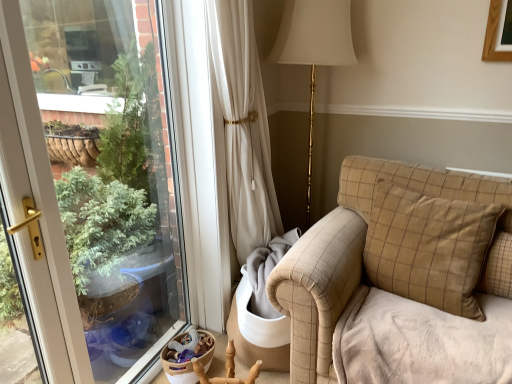
What do you see at coordinates (498, 267) in the screenshot? The height and width of the screenshot is (384, 512). I see `beige checkered pillow at right` at bounding box center [498, 267].

At what (x,y) coordinates should I click in order to perform the action: click on beige checkered couch at right. Please return your answer as a coordinate pair (x, y). This screenshot has width=512, height=384. Looking at the image, I should click on (353, 253).

Image resolution: width=512 pixels, height=384 pixels. What are the coordinates of `wooden armchair at lower center` in the screenshot? It's located at (227, 370).

You are a GUI agent. You are given a task and a screenshot of the screen. Output one action in this format:
    pyautogui.click(x=<x>, y=<y>)
    Task: Click on the beige checkered pillow at right
    The width and height of the screenshot is (512, 384).
    Given the screenshot: What is the action you would take?
    pyautogui.click(x=498, y=267)

Which is more to the left, wooden armchair at lower center or beige checkered couch at right?

wooden armchair at lower center.

Between wooden armchair at lower center and beige checkered couch at right, which one has more height?

beige checkered couch at right is taller.

Identify the location of armchair below the beige checkered couch at right (from a real-world perspective). This screenshot has height=384, width=512. (227, 370).

Based on their sizes in the image, would you say beige checkered pillow at right is bigger or smaller than beige checkered couch at right?

beige checkered pillow at right is smaller than beige checkered couch at right.

Considering the relative sizes of beige checkered pillow at right and beige checkered couch at right in the image provided, is beige checkered pillow at right wider than beige checkered couch at right?

No, beige checkered pillow at right is not wider than beige checkered couch at right.

Considering the sizes of objects beige checkered pillow at right and beige checkered couch at right in the image provided, who is taller, beige checkered pillow at right or beige checkered couch at right?

beige checkered couch at right.

Who is more distant, beige checkered pillow at right or wooden armchair at lower center?

wooden armchair at lower center is behind.

The image size is (512, 384). Identify the location of armchair that appears below the beige checkered pillow at right (from a real-world perspective). (227, 370).

From the image's perspective, who appears lower, beige checkered pillow at right or wooden armchair at lower center?

wooden armchair at lower center appears lower in the image.

Is wooden armchair at lower center not within beige checkered pillow at right?

Absolutely, wooden armchair at lower center is external to beige checkered pillow at right.

Is point (197, 366) more distant than point (490, 253)?

Yes, point (197, 366) is farther from viewer.

Which object is thinner, wooden armchair at lower center or beige checkered pillow at right?

Thinner between the two is beige checkered pillow at right.

Looking at this image, which of these two, wooden armchair at lower center or beige checkered pillow at right, stands shorter?

wooden armchair at lower center.

Can you confirm if beige checkered couch at right is positioned to the right of wooden armchair at lower center?

Yes, beige checkered couch at right is to the right of wooden armchair at lower center.

Is beige checkered couch at right aimed at wooden armchair at lower center?

No, beige checkered couch at right is not aimed at wooden armchair at lower center.

Is beige checkered couch at right positioned far away from wooden armchair at lower center?

No, there isn't a large distance between beige checkered couch at right and wooden armchair at lower center.

Could you tell me if beige checkered couch at right is turned towards beige checkered pillow at right?

No, beige checkered couch at right is not oriented towards beige checkered pillow at right.

From the image's perspective, who appears lower, beige checkered couch at right or beige checkered pillow at right?

beige checkered pillow at right is shown below in the image.

I want to click on armchair that is under the beige checkered couch at right (from a real-world perspective), so click(x=227, y=370).

You are a GUI agent. You are given a task and a screenshot of the screen. Output one action in this format:
    pyautogui.click(x=<x>, y=<y>)
    Task: Click on the studio couch positioned vertically above the beige checkered pillow at right (from a real-world perspective)
    
    Given the screenshot: What is the action you would take?
    pyautogui.click(x=353, y=253)

Which object lies nearer to the anchor point beige checkered couch at right, beige checkered pillow at right or wooden armchair at lower center?

Among the two, beige checkered pillow at right is located nearer to beige checkered couch at right.

When comparing their distances from beige checkered couch at right, does wooden armchair at lower center or beige checkered pillow at right seem closer?

beige checkered pillow at right is positioned closer to the anchor beige checkered couch at right.

When comparing their distances from beige checkered pillow at right, does beige checkered couch at right or wooden armchair at lower center seem closer?

Based on the image, beige checkered couch at right appears to be nearer to beige checkered pillow at right.

Based on their spatial positions, is beige checkered couch at right or beige checkered pillow at right closer to wooden armchair at lower center?

beige checkered couch at right.

From the picture: From the image, which object appears to be nearer to wooden armchair at lower center, beige checkered pillow at right or beige checkered couch at right?

The object closer to wooden armchair at lower center is beige checkered couch at right.

When comparing their distances from beige checkered pillow at right, does wooden armchair at lower center or beige checkered couch at right seem closer?

beige checkered couch at right is positioned closer to the anchor beige checkered pillow at right.

Find the location of a particular element. The image size is (512, 384). studio couch between wooden armchair at lower center and beige checkered pillow at right in the horizontal direction is located at coordinates (353, 253).